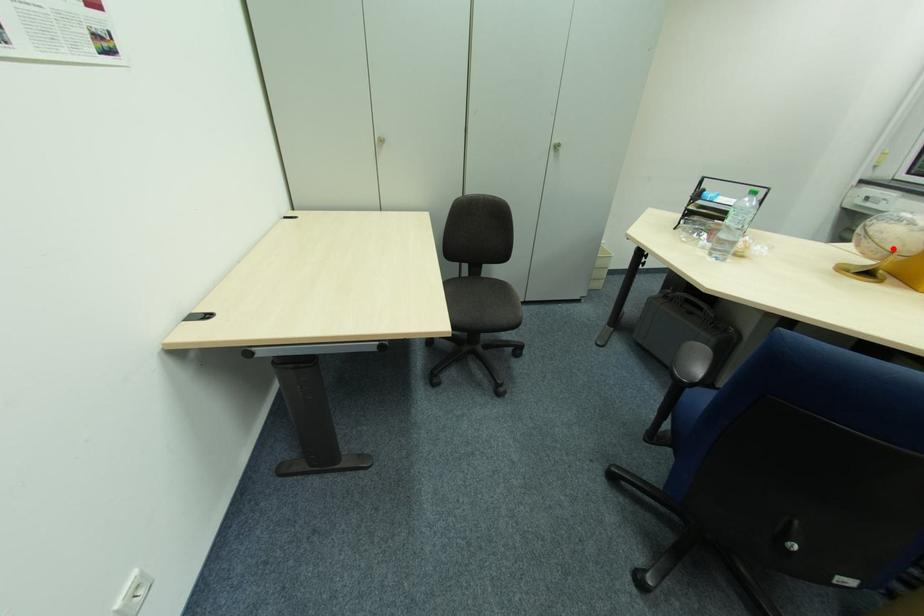
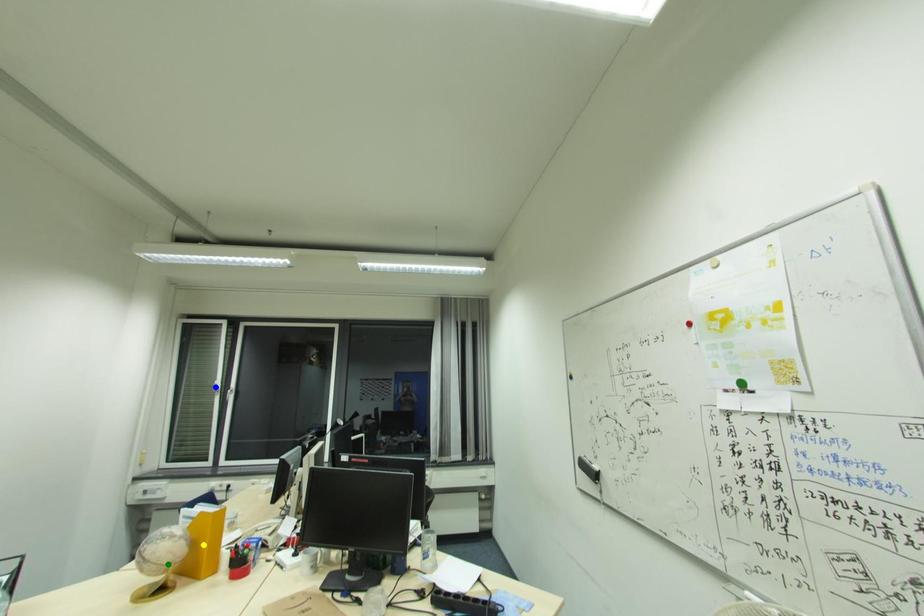
Question: I am providing you with two images of the same scene from different viewpoints. A red point is marked on the first image. You are given multiple points on the second image. In image 2, which mark is for the same physical point as the one in image 1?

Choices:
 (A) blue point
 (B) yellow point
 (C) green point

Answer: (C)